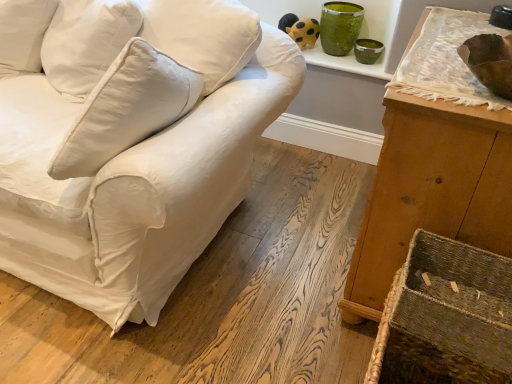
Question: From a real-world perspective, is white cotton couch at center physically below wooden cabinet at right?

Choices:
 (A) no
 (B) yes

Answer: (B)

Question: Can you confirm if white cotton couch at center is bigger than wooden cabinet at right?

Choices:
 (A) no
 (B) yes

Answer: (B)

Question: Is white cotton couch at center with wooden cabinet at right?

Choices:
 (A) yes
 (B) no

Answer: (B)

Question: From the image's perspective, would you say white cotton couch at center is shown under wooden cabinet at right?

Choices:
 (A) yes
 (B) no

Answer: (B)

Question: Can you confirm if white cotton couch at center is taller than wooden cabinet at right?

Choices:
 (A) no
 (B) yes

Answer: (A)

Question: In the image, is wooden cabinet at right positioned in front of or behind yellow matte plush toy at upper center?

Choices:
 (A) behind
 (B) front

Answer: (B)

Question: Is wooden cabinet at right taller or shorter than yellow matte plush toy at upper center?

Choices:
 (A) tall
 (B) short

Answer: (A)

Question: Is point (475, 167) positioned closer to the camera than point (298, 28)?

Choices:
 (A) farther
 (B) closer

Answer: (B)

Question: Is wooden cabinet at right bigger or smaller than yellow matte plush toy at upper center?

Choices:
 (A) big
 (B) small

Answer: (A)

Question: From their relative heights in the image, would you say white cotton couch at center is taller or shorter than yellow matte plush toy at upper center?

Choices:
 (A) tall
 (B) short

Answer: (A)

Question: Based on their positions, is white cotton couch at center located to the left or right of yellow matte plush toy at upper center?

Choices:
 (A) left
 (B) right

Answer: (A)

Question: Which is correct: white cotton couch at center is inside yellow matte plush toy at upper center, or outside of it?

Choices:
 (A) inside
 (B) outside

Answer: (B)

Question: Is white cotton couch at center bigger or smaller than yellow matte plush toy at upper center?

Choices:
 (A) big
 (B) small

Answer: (A)

Question: From a real-world perspective, is yellow matte plush toy at upper center above or below rustic woven basket at lower right?

Choices:
 (A) above
 (B) below

Answer: (A)

Question: Considering the positions of yellow matte plush toy at upper center and rustic woven basket at lower right in the image, is yellow matte plush toy at upper center bigger or smaller than rustic woven basket at lower right?

Choices:
 (A) big
 (B) small

Answer: (B)